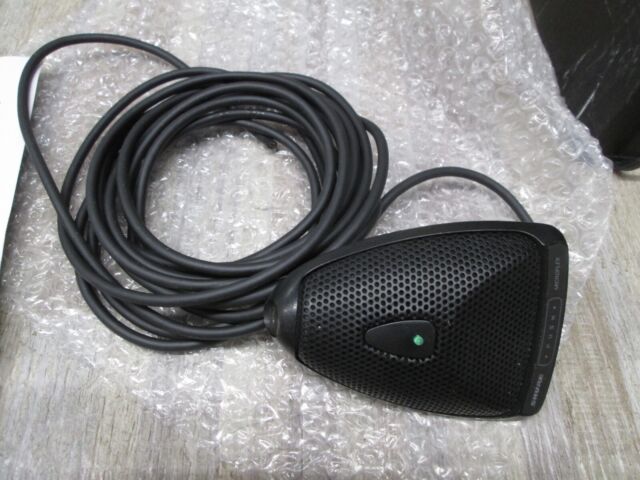
Locate an element on the screen. The height and width of the screenshot is (480, 640). surface the device is sitting on is located at coordinates (614, 423).